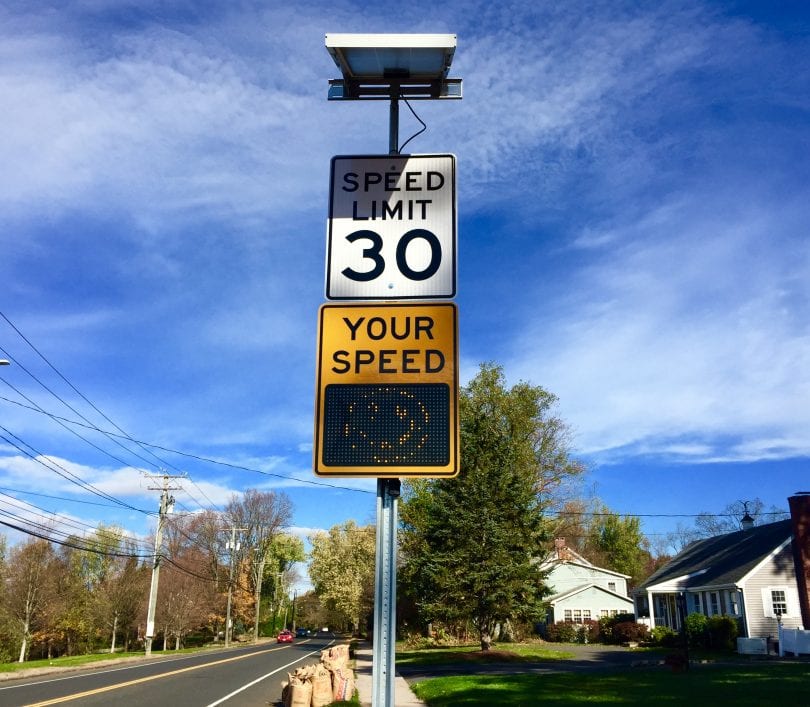
I want to click on board, so pyautogui.click(x=399, y=73).